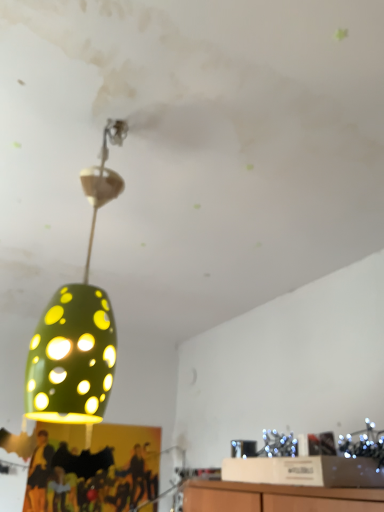
Question: Is green matte/porcelain lampshade at upper left closer to camera compared to green matte lampshade at center?

Choices:
 (A) yes
 (B) no

Answer: (B)

Question: Considering the relative sizes of green matte/porcelain lampshade at upper left and green matte lampshade at center in the image provided, is green matte/porcelain lampshade at upper left thinner than green matte lampshade at center?

Choices:
 (A) no
 (B) yes

Answer: (B)

Question: Does green matte/porcelain lampshade at upper left have a lesser height compared to green matte lampshade at center?

Choices:
 (A) yes
 (B) no

Answer: (B)

Question: Is green matte/porcelain lampshade at upper left wider than green matte lampshade at center?

Choices:
 (A) yes
 (B) no

Answer: (B)

Question: From the image's perspective, is green matte/porcelain lampshade at upper left under green matte lampshade at center?

Choices:
 (A) no
 (B) yes

Answer: (B)

Question: From the image's perspective, is green matte/porcelain lampshade at upper left on top of green matte lampshade at center?

Choices:
 (A) no
 (B) yes

Answer: (A)

Question: Considering the relative sizes of green matte/porcelain lampshade at upper left and yellow fabric person at lower left in the image provided, is green matte/porcelain lampshade at upper left wider than yellow fabric person at lower left?

Choices:
 (A) yes
 (B) no

Answer: (A)

Question: Does green matte/porcelain lampshade at upper left have a lesser width compared to yellow fabric person at lower left?

Choices:
 (A) yes
 (B) no

Answer: (B)

Question: From the image's perspective, is green matte/porcelain lampshade at upper left on yellow fabric person at lower left?

Choices:
 (A) no
 (B) yes

Answer: (B)

Question: Is green matte/porcelain lampshade at upper left far from yellow fabric person at lower left?

Choices:
 (A) yes
 (B) no

Answer: (A)

Question: Is green matte/porcelain lampshade at upper left oriented away from yellow fabric person at lower left?

Choices:
 (A) no
 (B) yes

Answer: (A)

Question: Is green matte/porcelain lampshade at upper left shorter than yellow fabric person at lower left?

Choices:
 (A) yes
 (B) no

Answer: (B)

Question: From the image's perspective, is yellow fabric person at lower left located above green matte lampshade at center?

Choices:
 (A) no
 (B) yes

Answer: (A)